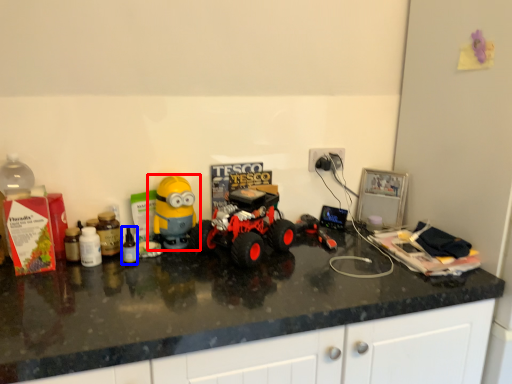
Question: Which object is further to the camera taking this photo, toy (highlighted by a red box) or bottle (highlighted by a blue box)?

Choices:
 (A) toy
 (B) bottle

Answer: (A)